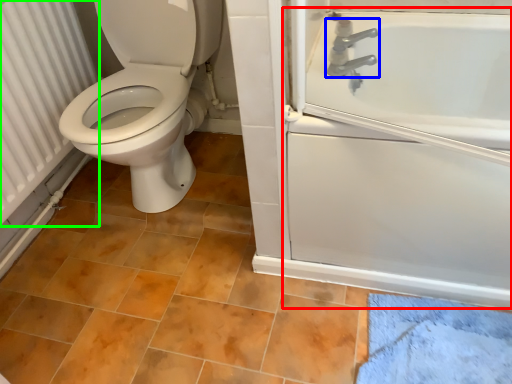
Question: Which is farther away from bath (highlighted by a red box)? tap (highlighted by a blue box) or radiator (highlighted by a green box)?

Choices:
 (A) tap
 (B) radiator

Answer: (B)